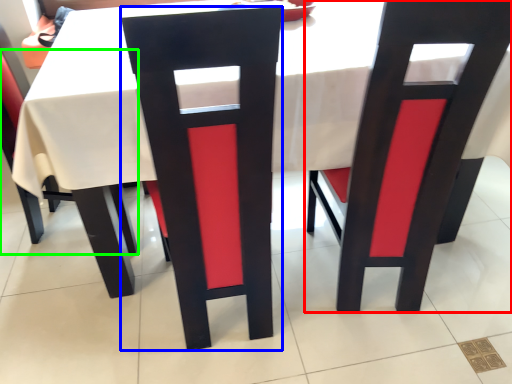
Question: Which object is positioned farthest from chair (highlighted by a red box)? Select from chair (highlighted by a blue box) and chair (highlighted by a green box).

Choices:
 (A) chair
 (B) chair

Answer: (B)